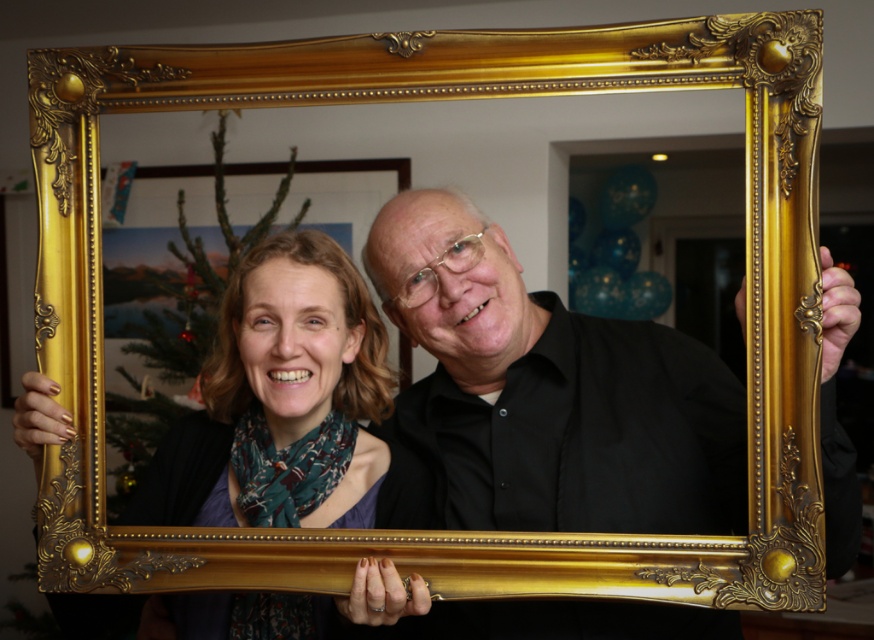
Is black matte shirt at center positioned in front of matte gold frame at center?

Yes, it is.

Does black matte shirt at center have a larger size compared to matte gold frame at center?

Yes.

Where is `black matte shirt at center`? black matte shirt at center is located at coordinates (543, 397).